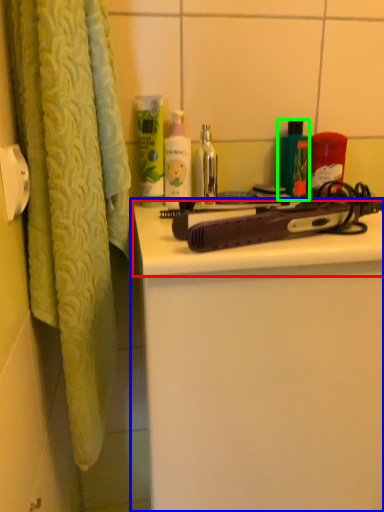
Question: Which object is the closest to the counter top (highlighted by a red box)? Choose among these: bathroom cabinet (highlighted by a blue box) or product (highlighted by a green box).

Choices:
 (A) bathroom cabinet
 (B) product

Answer: (A)